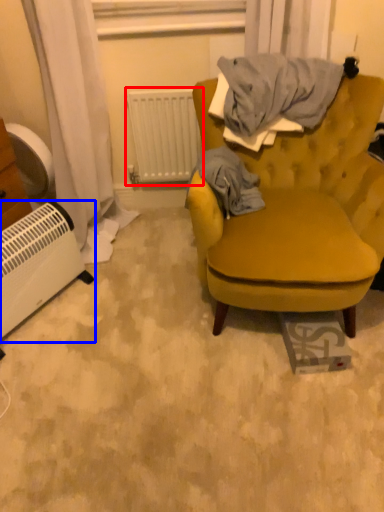
Question: Which of the following is the closest to the observer, radiator (highlighted by a red box) or appliance (highlighted by a blue box)?

Choices:
 (A) radiator
 (B) appliance

Answer: (B)